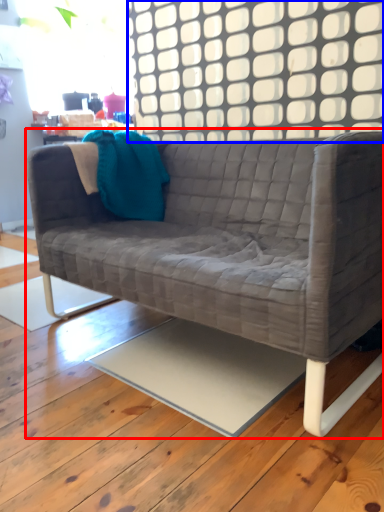
Question: Which point is further to the camera, studio couch (highlighted by a red box) or window (highlighted by a blue box)?

Choices:
 (A) studio couch
 (B) window

Answer: (B)